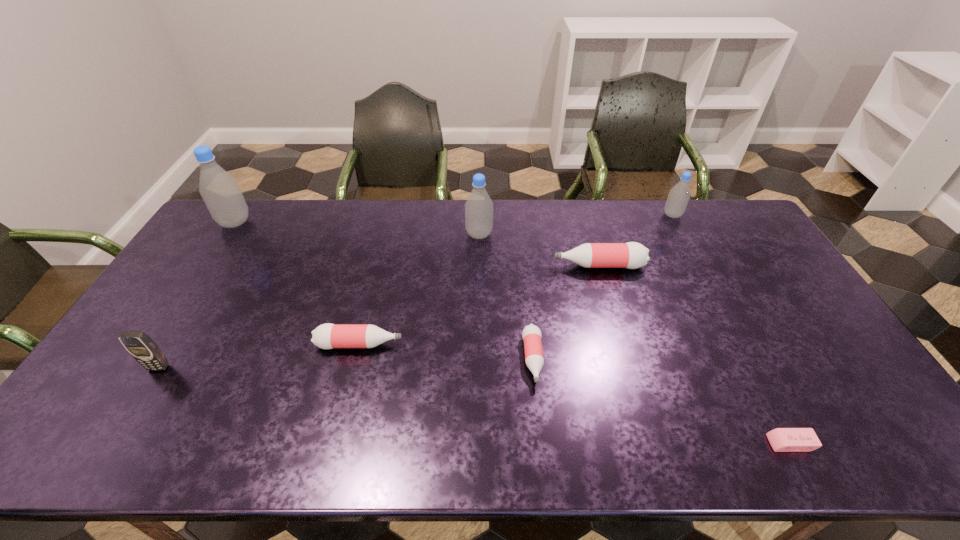
The width and height of the screenshot is (960, 540). What are the coordinates of `vacant space that's between the tallest object and the third tallest bottle` in the screenshot? It's located at pyautogui.click(x=454, y=219).

Locate an element on the screen. The image size is (960, 540). free space between the fifth tallest bottle and the fifth bottle from left to right is located at coordinates (479, 305).

Find the location of a particular element. free space between the rightmost bottle and the pink eraser is located at coordinates (732, 329).

The height and width of the screenshot is (540, 960). Find the location of `unoccupied position between the cellular telephone and the third bottle from right to left`. unoccupied position between the cellular telephone and the third bottle from right to left is located at coordinates (346, 363).

This screenshot has height=540, width=960. What are the coordinates of `the fourth closest object to the shortest object` in the screenshot? It's located at (326, 336).

Where is `object that stands as the closest to the second pink bottle from left to right`? object that stands as the closest to the second pink bottle from left to right is located at coordinates (631, 255).

Find the location of a particular element. This screenshot has width=960, height=540. bottle identified as the fourth closest to the fifth shortest object is located at coordinates (531, 334).

This screenshot has width=960, height=540. Identify the location of the fifth closest bottle to the biggest gray bottle. (678, 198).

At what (x,y) coordinates should I click in order to perform the action: click on the third closest gray bottle relative to the pink eraser. Please return your answer as a coordinate pair (x, y). Looking at the image, I should click on (220, 191).

Where is `gray bottle that is the second closest one to the eraser`? The height and width of the screenshot is (540, 960). gray bottle that is the second closest one to the eraser is located at coordinates (479, 207).